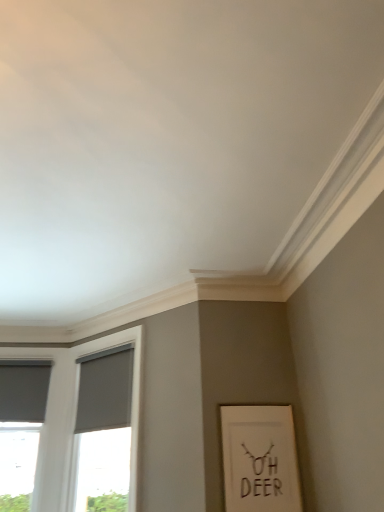
Question: Would you say matte gray curtain at left, marked as the 1th curtain in a left-to-right arrangement, is inside or outside matte gray curtain at lower left, acting as the second curtain starting from the left?

Choices:
 (A) outside
 (B) inside

Answer: (A)

Question: Is matte gray curtain at left, marked as the 1th curtain in a left-to-right arrangement, in front of or behind matte gray curtain at lower left, which is the 1th curtain in right-to-left order, in the image?

Choices:
 (A) behind
 (B) front

Answer: (A)

Question: Considering the real-world distances, which object is farthest from the matte gray window at left?

Choices:
 (A) matte gray curtain at left, the second curtain in the right-to-left sequence
 (B) matte gray curtain at lower left, acting as the second curtain starting from the left
 (C) white matte picture frame at lower right

Answer: (C)

Question: Which object is the farthest from the matte gray curtain at lower left, which is the 1th curtain in right-to-left order?

Choices:
 (A) matte gray window at left
 (B) matte gray curtain at left, the second curtain in the right-to-left sequence
 (C) white matte picture frame at lower right

Answer: (C)